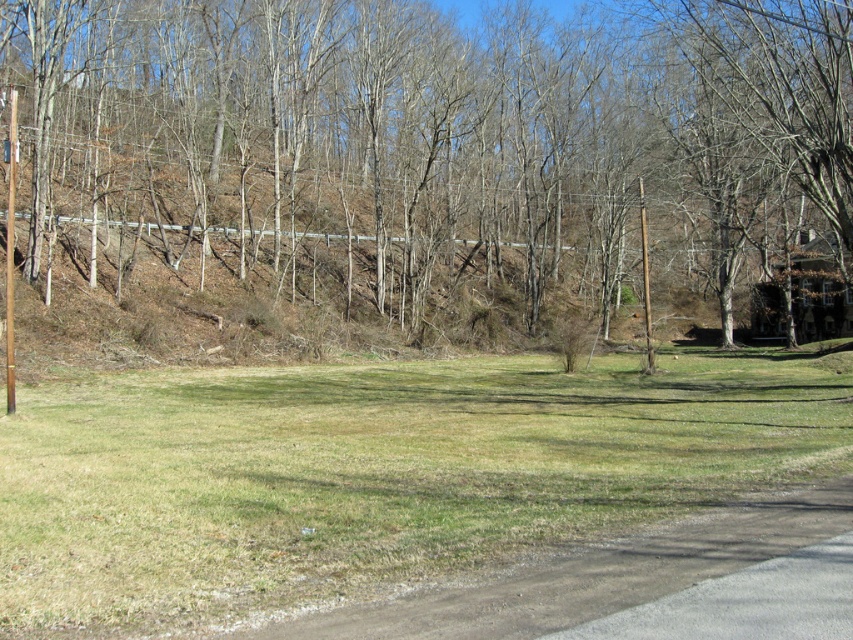
Does brown/dry grass at center appear over brown wooden telegraph pole at left?

Yes.

In the scene shown: Is brown/dry grass at center positioned before brown wooden telegraph pole at left?

No, brown/dry grass at center is further to the viewer.

What do you see at coordinates (437, 157) in the screenshot?
I see `brown/dry grass at center` at bounding box center [437, 157].

The image size is (853, 640). Identify the location of brown/dry grass at center. (437, 157).

Consider the image. Measure the distance from brown/dry grass at center to green grass at lower center.

A distance of 26.61 meters exists between brown/dry grass at center and green grass at lower center.

From the picture: Can you confirm if brown/dry grass at center is taller than green grass at lower center?

Yes, brown/dry grass at center is taller than green grass at lower center.

Describe the element at coordinates (437, 157) in the screenshot. The width and height of the screenshot is (853, 640). I see `brown/dry grass at center` at that location.

Where is `brown/dry grass at center`? brown/dry grass at center is located at coordinates pos(437,157).

Does green grass at lower center appear on the right side of brown wooden telegraph pole at left?

Correct, you'll find green grass at lower center to the right of brown wooden telegraph pole at left.

Is point (839, 448) behind point (10, 148)?

No, (839, 448) is closer to viewer.

Locate an element on the screen. green grass at lower center is located at coordinates (373, 474).